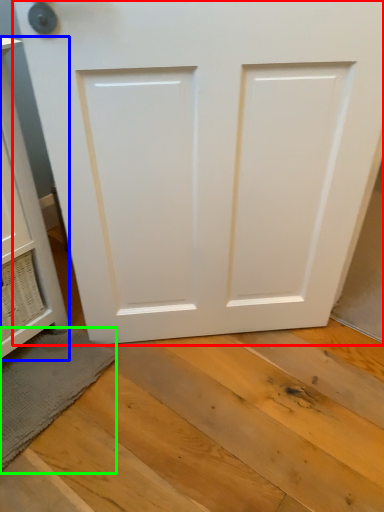
Question: Which object is positioned farthest from door (highlighted by a red box)? Select from cabinetry (highlighted by a blue box) and bath mat (highlighted by a green box).

Choices:
 (A) cabinetry
 (B) bath mat

Answer: (B)